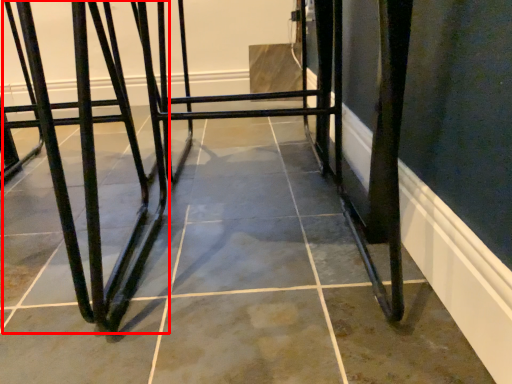
Question: From the image, what is the correct spatial relationship of bar stool (annotated by the red box) in relation to furniture?

Choices:
 (A) left
 (B) right

Answer: (A)